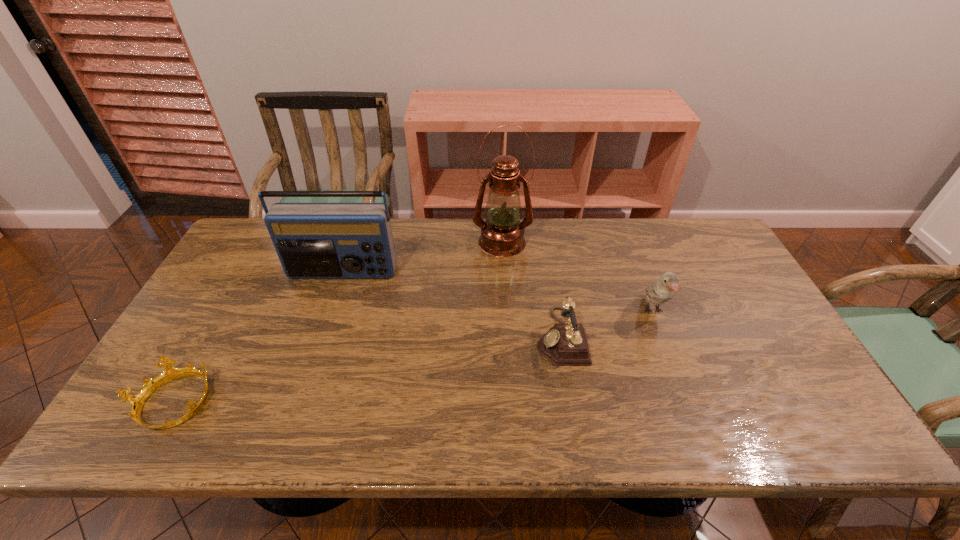
Locate an element on the screen. The width and height of the screenshot is (960, 540). object located at the near left corner is located at coordinates (137, 401).

Locate an element on the screen. The height and width of the screenshot is (540, 960). vacant region at the far edge of the desktop is located at coordinates (623, 255).

You are a GUI agent. You are given a task and a screenshot of the screen. Output one action in this format:
    pyautogui.click(x=<x>, y=<y>)
    Task: Click on the free space at the near edge of the desktop
    The height and width of the screenshot is (540, 960).
    Given the screenshot: What is the action you would take?
    pyautogui.click(x=759, y=426)

The height and width of the screenshot is (540, 960). I want to click on free space at the left edge, so click(x=218, y=309).

In the image, there is a desktop. Where is `blank space at the right edge`? blank space at the right edge is located at coordinates (802, 401).

Locate an element on the screen. The image size is (960, 540). vacant space at the far left corner is located at coordinates (251, 257).

Find the location of a particular element. blank region between the leftmost object and the telephone is located at coordinates (367, 370).

This screenshot has height=540, width=960. What are the coordinates of `vacant area between the second tallest object and the bird` in the screenshot? It's located at (497, 292).

I want to click on vacant space that's between the second tallest object and the tallest object, so click(422, 258).

Find the location of `vacant space that is in between the fourth tallest object and the second object from left to right`. vacant space that is in between the fourth tallest object and the second object from left to right is located at coordinates (452, 305).